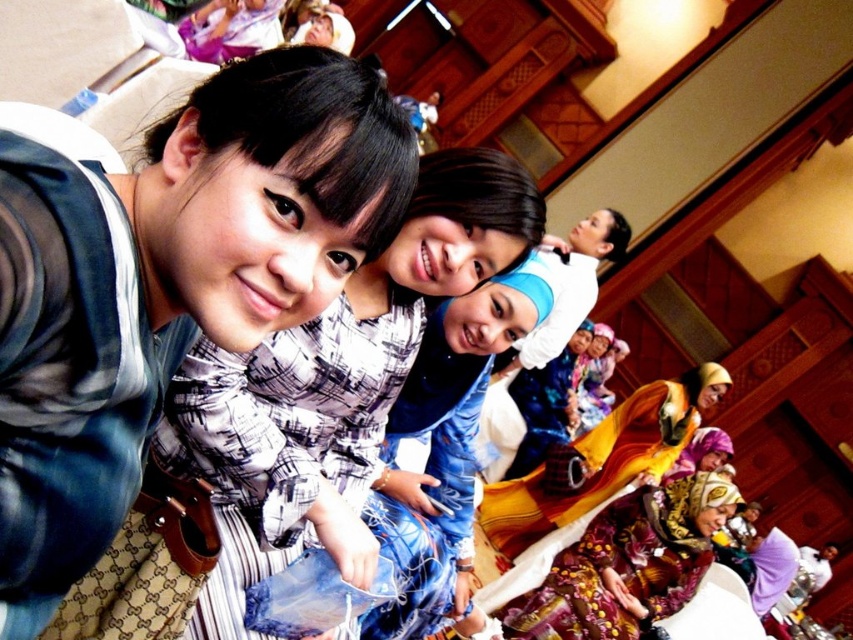
Which is more to the left, matte blue dress at center or printed silk dress at lower right?

From the viewer's perspective, matte blue dress at center appears more on the left side.

Which of these two, matte blue dress at center or printed silk dress at lower right, stands taller?

matte blue dress at center

Is point (358, 476) positioned after point (599, 627)?

That is False.

Identify the location of matte blue dress at center. This screenshot has width=853, height=640. (340, 372).

Which is more to the right, matte blue dress at center or yellow satin dress at lower right?

yellow satin dress at lower right

In the scene shown: Is matte blue dress at center wider than yellow satin dress at lower right?

No.

Which is behind, point (235, 576) or point (654, 420)?

The point (654, 420) is more distant.

This screenshot has width=853, height=640. Identify the location of matte blue dress at center. (340, 372).

Does matte black shirt at center have a greater height compared to yellow satin dress at lower right?

In fact, matte black shirt at center may be shorter than yellow satin dress at lower right.

Does matte black shirt at center have a lesser height compared to yellow satin dress at lower right?

Yes.

Is point (18, 189) closer to camera compared to point (585, 477)?

Yes, it is.

Image resolution: width=853 pixels, height=640 pixels. Identify the location of matte black shirt at center. (167, 284).